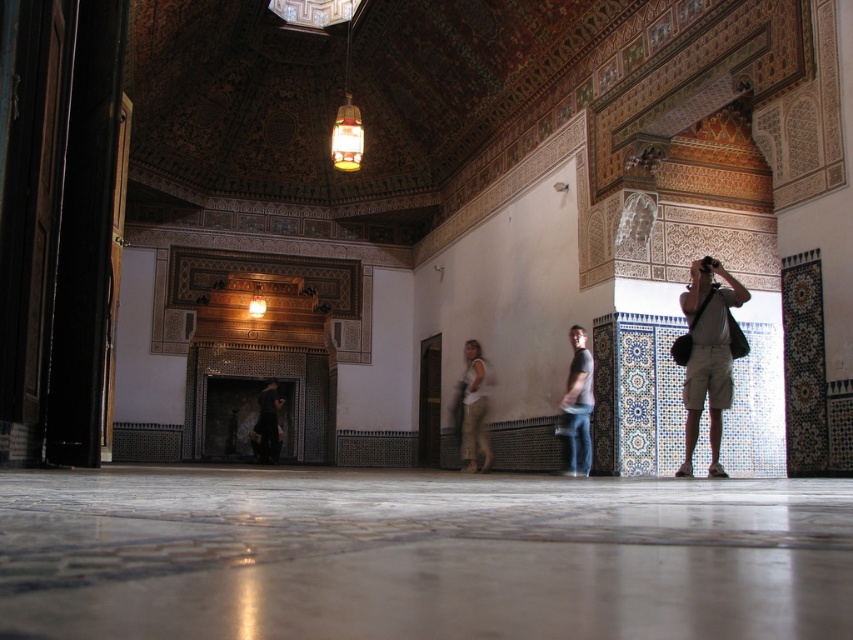
Question: Can you confirm if denim jeans at center is positioned to the right of light beige cotton pants at center?

Choices:
 (A) yes
 (B) no

Answer: (A)

Question: Is light beige shorts at right thinner than denim jeans at center?

Choices:
 (A) yes
 (B) no

Answer: (B)

Question: Based on their relative distances, which object is farther from the light beige shorts at right?

Choices:
 (A) denim jeans at center
 (B) light beige cotton pants at center
 (C) dark brown leather jacket at center

Answer: (C)

Question: Which of the following is the farthest from the observer?

Choices:
 (A) (698, 378)
 (B) (267, 410)
 (C) (469, 346)
 (D) (569, 429)

Answer: (B)

Question: Which object appears closest to the camera in this image?

Choices:
 (A) light beige shorts at right
 (B) dark brown leather jacket at center
 (C) denim jeans at center

Answer: (A)

Question: Is light beige cotton pants at center closer to camera compared to dark brown leather jacket at center?

Choices:
 (A) yes
 (B) no

Answer: (A)